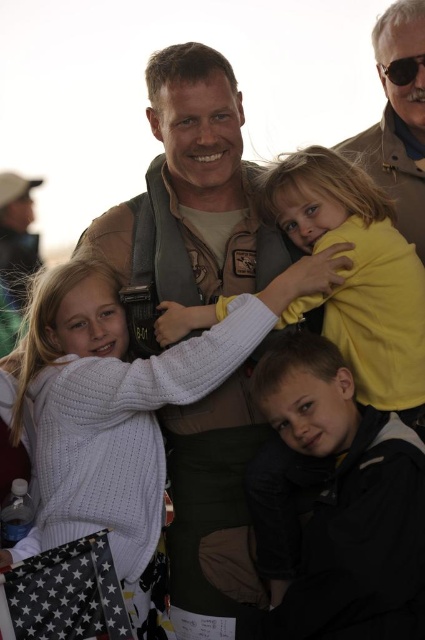
You are a photographer adjusting your camera focus. You need to focus on two specific points in the image, point 1 at coordinate point (x=374, y=518) and point 2 at coordinate point (x=413, y=163). Which point is closer to the camera?

Point (x=374, y=518) is closer to the camera than point (x=413, y=163).

You are taking a photo of the scene and want to focus on both point (277, 179) and point (402, 38). Which point should you focus on first to ensure both are in sharp focus?

Point (277, 179) is closer to the camera than point (402, 38), so you should focus on point (277, 179) first to ensure both are in sharp focus.